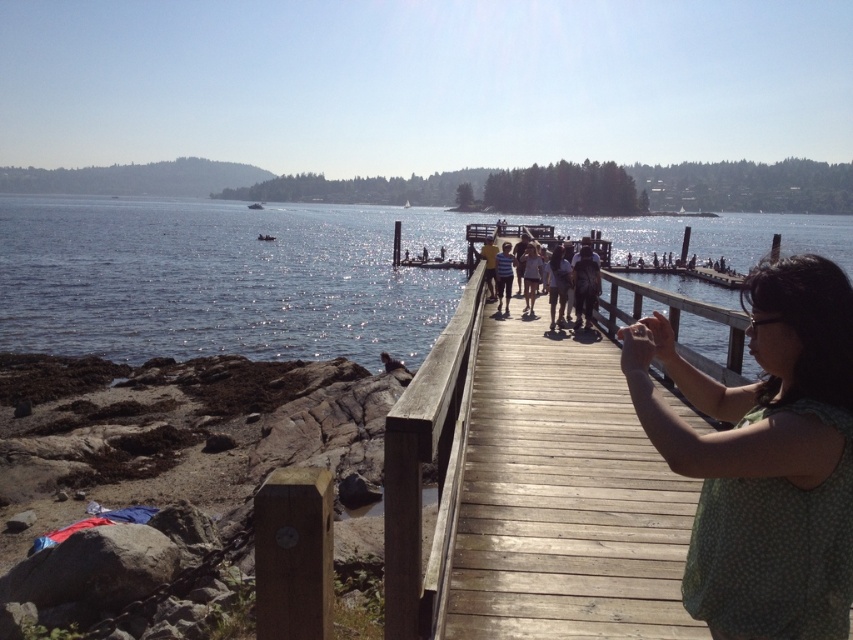
You are standing on the wooden dock at center and want to move towards the striped shirt at center. In which direction should you walk?

You should walk to the right because the wooden dock at center is to the left of striped shirt at center, so moving right will bring you closer to the striped shirt at center.

You are a photographer at the waterfront scene. You want to capture a photo that includes both the green dotted dress at center and the striped shirt at center. Since you want to highlight the height difference between them, which clothing item should you position closer to the camera to emphasize its height?

To emphasize the height difference between the green dotted dress at center and the striped shirt at center, you should position the green dotted dress at center closer to the camera because it is much taller than the striped shirt at center, making its height more prominent in the photo.